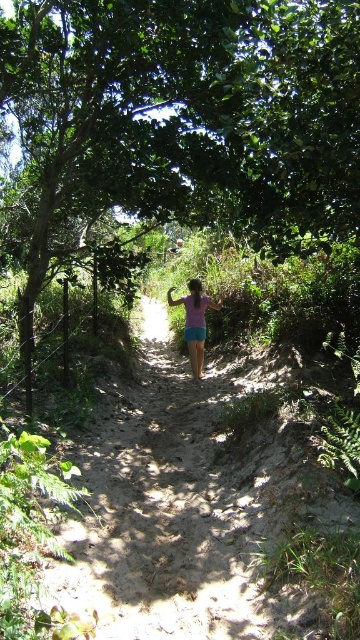
You are standing at the point marked by the coordinates point (200,109) in the image. What object is located at that point?

The point (200,109) indicates a green leafy tree at center.

You are a fashion designer observing two people walking on the sandy pathway. You notice the pink fabric shorts at center and the purple cotton shorts at center. Which pair of shorts is closer to the camera?

The pink fabric shorts at center is 11.02 inches from the purple cotton shorts at center, so the purple cotton shorts at center is closer to the camera since it is positioned behind the pink fabric shorts at center.